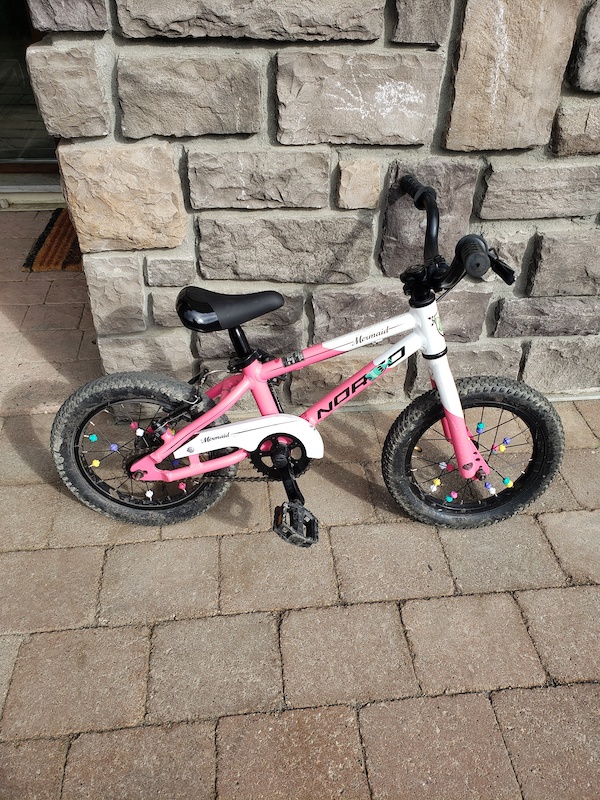
This screenshot has height=800, width=600. What are the coordinates of `wall` in the screenshot? It's located at (126, 314).